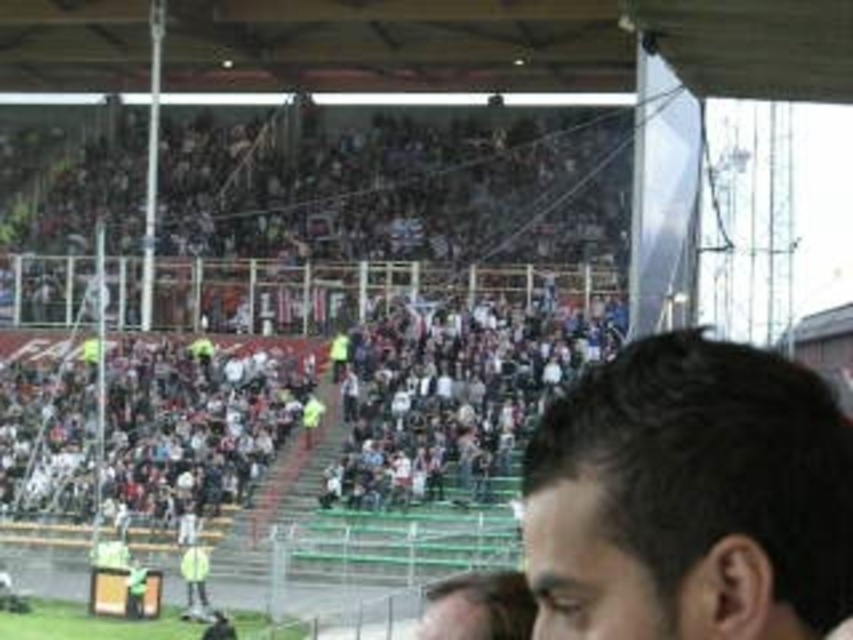
Does multicolored fabric crowd at upper center appear on the left side of dark brown hair at lower right?

Correct, you'll find multicolored fabric crowd at upper center to the left of dark brown hair at lower right.

Consider the image. Which is below, multicolored fabric crowd at upper center or dark brown hair at lower right?

dark brown hair at lower right is lower down.

Does point (560, 310) come farther from viewer compared to point (722, 349)?

Yes, it is behind point (722, 349).

Where is `multicolored fabric crowd at upper center`? multicolored fabric crowd at upper center is located at coordinates (360, 304).